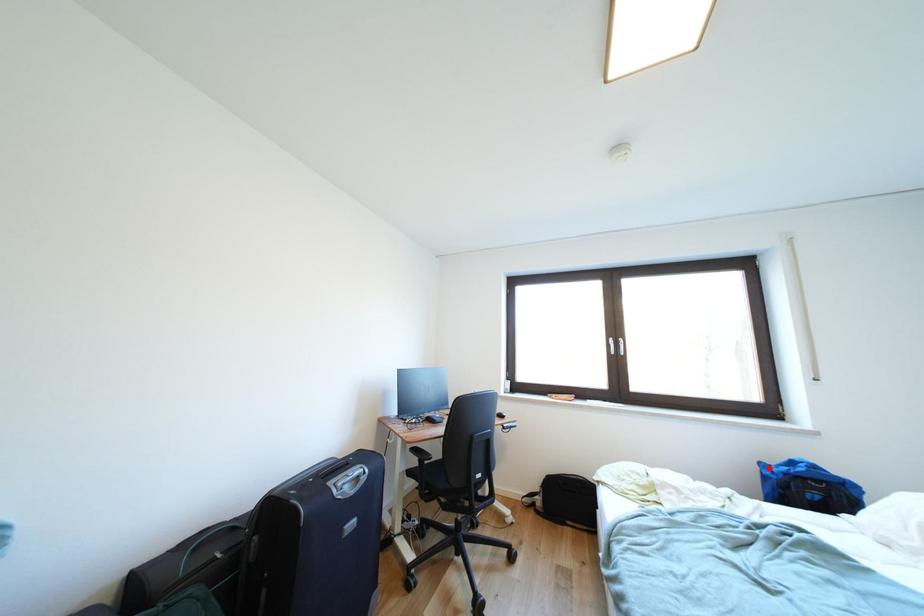
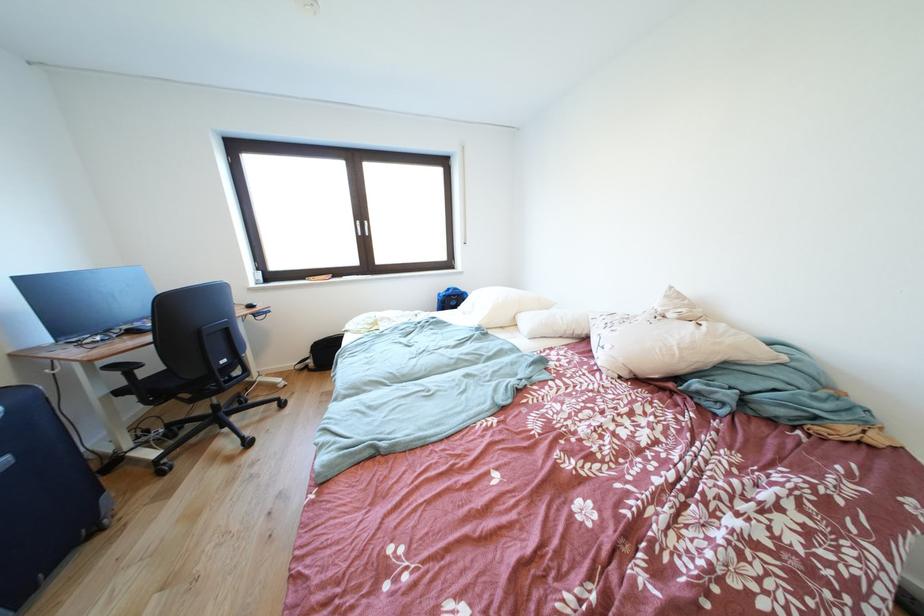
Locate, in the second image, the point that corresponds to the highlighted location in the first image.

(447, 299)